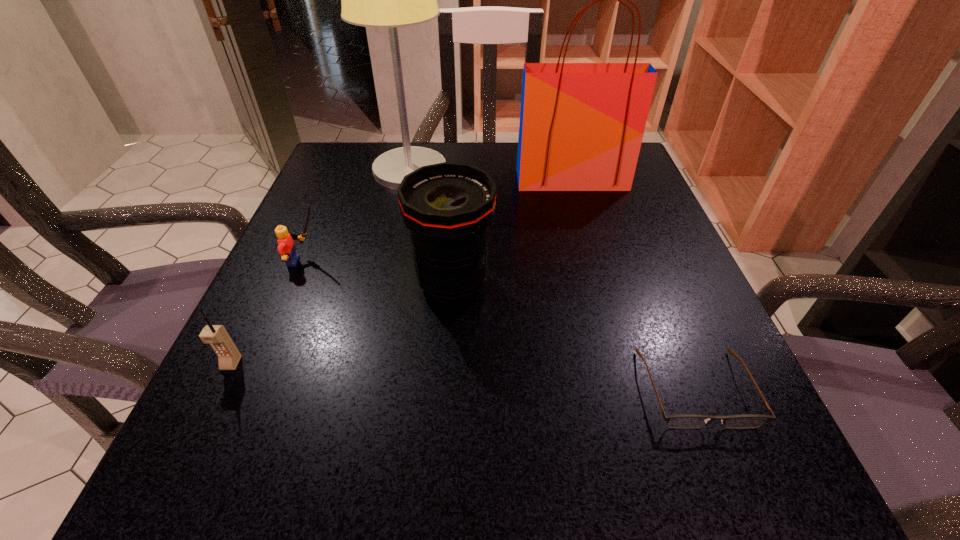
Where is `vacant space located 0.050m on the front-facing side of the Lego`? Image resolution: width=960 pixels, height=540 pixels. vacant space located 0.050m on the front-facing side of the Lego is located at coordinates (350, 261).

Where is `vacant space located 0.050m on the front-facing side of the spectacles`? The image size is (960, 540). vacant space located 0.050m on the front-facing side of the spectacles is located at coordinates (728, 469).

The height and width of the screenshot is (540, 960). In order to click on table lamp that is positioned at the far edge in this screenshot , I will do `click(389, 0)`.

Where is `shopping bag that is at the far edge`? shopping bag that is at the far edge is located at coordinates (581, 127).

Identify the location of table lamp present at the left edge. (389, 0).

Locate an element on the screen. cellular telephone that is at the left edge is located at coordinates (229, 356).

Identify the location of Lego at the left edge. Image resolution: width=960 pixels, height=540 pixels. (286, 247).

The width and height of the screenshot is (960, 540). What are the coordinates of `shopping bag positioned at the right edge` in the screenshot? It's located at (581, 127).

I want to click on spectacles that is at the right edge, so click(685, 421).

I want to click on object positioned at the far left corner, so click(x=389, y=0).